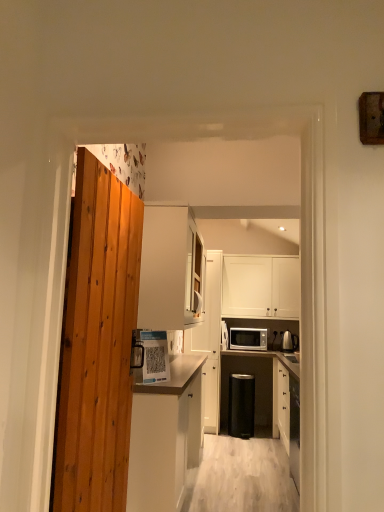
Question: Is point (134, 368) closer or farther from the camera than point (253, 349)?

Choices:
 (A) farther
 (B) closer

Answer: (B)

Question: Is white glossy paper at center, which appears as the first appliance when viewed from the front, inside the boundaries of matte white microwave at center, or outside?

Choices:
 (A) inside
 (B) outside

Answer: (B)

Question: Estimate the real-world distances between objects in this image. Which object is closer to the matte white microwave at center?

Choices:
 (A) metallic silver kettle at right, which is the second appliance from bottom to top
 (B) white matte cabinet at upper center, the third cabinetry from the left
 (C) white glossy paper at center, which appears as the first appliance when viewed from the front
 (D) white matte cabinet at upper center, which is counted as the 1th cabinetry, starting from the right
 (E) black plastic trash can at center, the third appliance from the top

Answer: (A)

Question: Which object is positioned closest to the white matte cabinet at upper center, the third cabinetry from the left?

Choices:
 (A) metallic silver kettle at right, the third appliance from the front
 (B) white matte cabinet at upper center, the third cabinetry positioned from the right
 (C) white matte cabinet at upper center, arranged as the fourth cabinetry when viewed from the left
 (D) white glossy paper at center, which is the first appliance in top-to-bottom order
 (E) white matte cabinet at center, arranged as the fourth cabinetry when viewed from the right

Answer: (E)